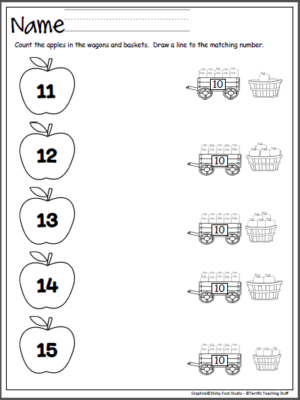
Identify the location of basket. (267, 360), (262, 293), (259, 233), (261, 160), (263, 84).